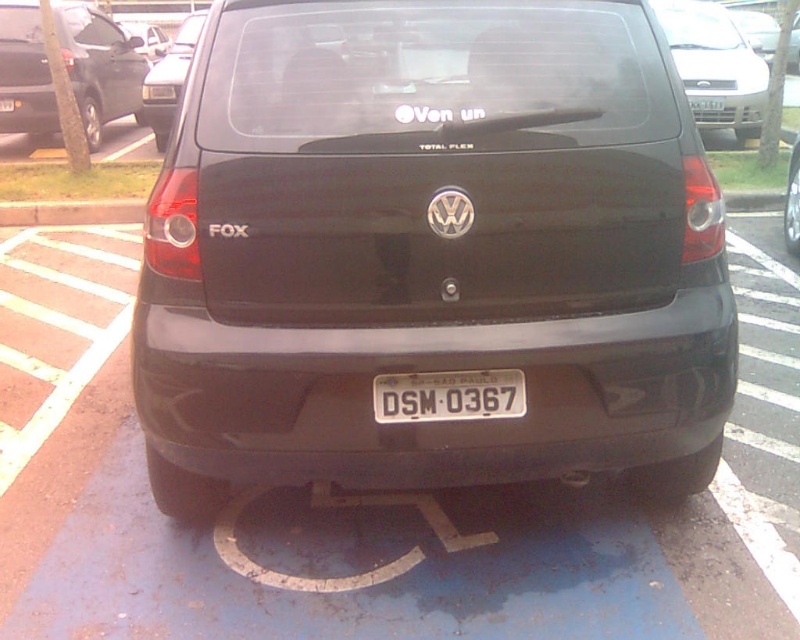
Question: Does silver metallic sedan at upper right appear on the left side of smooth concrete curb at lower left?

Choices:
 (A) yes
 (B) no

Answer: (B)

Question: Which of the following is the farthest from the observer?

Choices:
 (A) (668, 68)
 (B) (54, 211)
 (C) (150, 84)
 (D) (26, 106)

Answer: (C)

Question: Observing the image, what is the correct spatial positioning of silver metallic sedan at upper right in reference to smooth concrete curb at lower left?

Choices:
 (A) left
 (B) right

Answer: (B)

Question: Among these objects, which one is farthest from the camera?

Choices:
 (A) white metallic license plate at center
 (B) smooth concrete curb at lower left

Answer: (B)

Question: Is matte black car at center positioned in front of smooth concrete curb at lower left?

Choices:
 (A) yes
 (B) no

Answer: (A)

Question: Which object appears farthest from the camera in this image?

Choices:
 (A) smooth concrete curb at lower left
 (B) matte black car at center

Answer: (A)